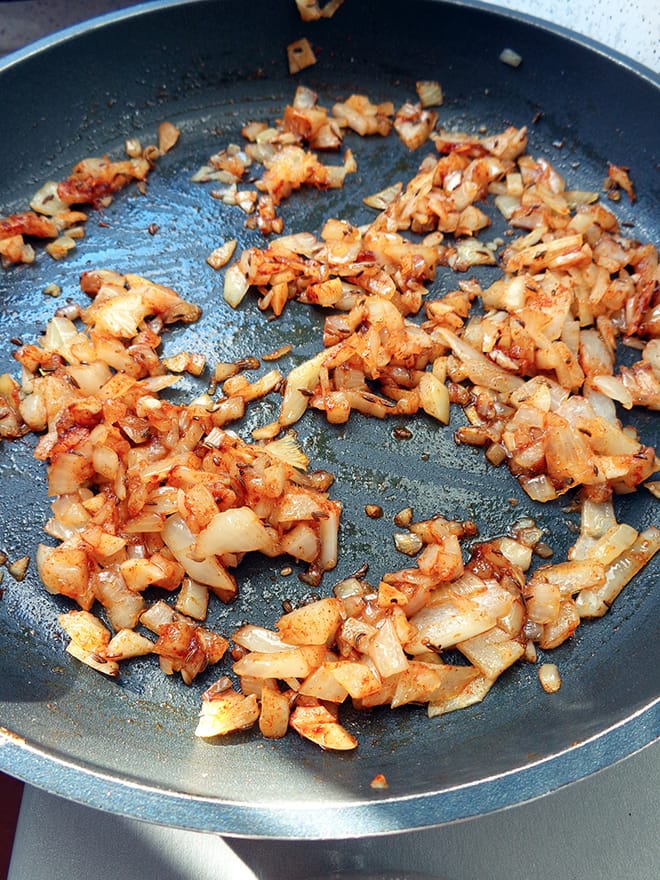
I want to click on slightly red floor, so click(x=11, y=809).